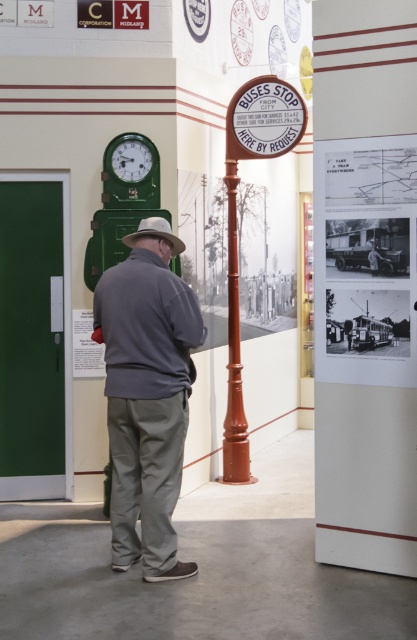
You are an artist who wants to sketch the scene. You notice two items in the image that are important to include. The first is the gray cotton jacket at center, and the second is the black paper at upper right. Based on their positions, which of these two items should you draw first if you are following a left to right drawing technique?

The gray cotton jacket at center should be drawn first because it is positioned to the left of the black paper at upper right, following the left to right drawing technique.

You are an interior designer assessing the layout of this transportation museum. You notice the gray cotton jacket at center and the black paper at upper right. Which object has a greater width?

The gray cotton jacket at center has a greater width than the black paper at upper right.

From the picture: You are a visitor at the museum and want to locate the black paper at upper right. According to the coordinates provided, where should you look in the scene?

The black paper at upper right is located at point coordinates (364, 259).